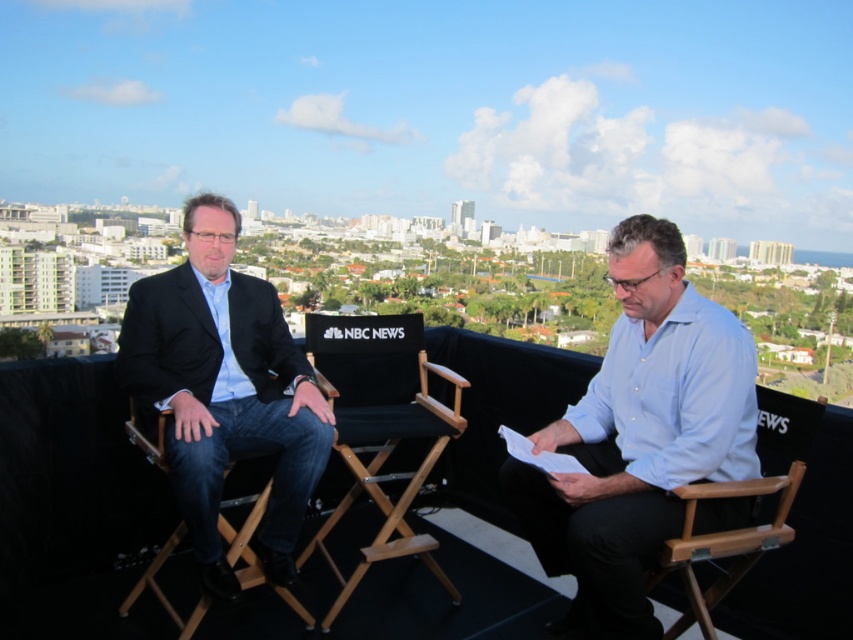
You are a photographer positioned behind the two people in the image. You want to focus your camera on the matte black suit at left without blurring the black fabric chair at center. Is this possible given their positions?

The matte black suit at left is closer to the viewer than the black fabric chair at center, so focusing on the matte black suit at left will naturally keep the black fabric chair at center in focus as well.

In the scene shown: You are a photographer standing at point (381, 440). You want to take a photo of the black fabric chair at center. Is the chair within your current field of view?

Yes, the chair is exactly at your current position, so it is within your field of view.

You are a photographer positioned behind the two people in the image. You need to capture a photo where the matte black suit at left and the black fabric chair at center are both clearly visible. Since both objects are black, which one should you adjust the camera focus on first to ensure proper exposure, considering their positions?

Since the matte black suit at left is to the left of the black fabric chair at center, you should focus on the matte black suit at left first as it is closer to the photographer, ensuring proper exposure before adjusting for the chair.